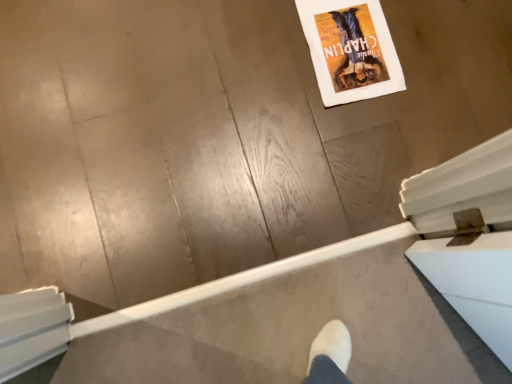
Identify the location of free space to the left of white paper towel at upper center. (260, 57).